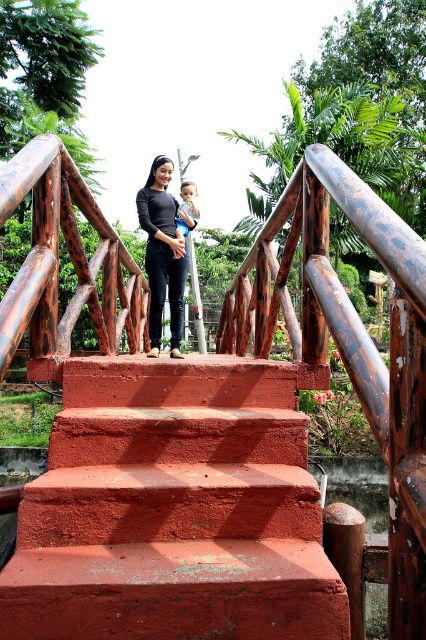
Can you confirm if smooth red concrete stairs at center is thinner than black matte shirt at center?

Incorrect, smooth red concrete stairs at center's width is not less than black matte shirt at center's.

Can you confirm if smooth red concrete stairs at center is taller than black matte shirt at center?

No, smooth red concrete stairs at center is not taller than black matte shirt at center.

Does point (293, 520) lie in front of point (152, 262)?

That is True.

Where is `smooth red concrete stairs at center`? This screenshot has height=640, width=426. smooth red concrete stairs at center is located at coordinates (173, 509).

Is black matte shirt at center positioned at the back of smooth skin baby at center?

No, black matte shirt at center is closer to the viewer.

Is black matte shirt at center above smooth skin baby at center?

Actually, black matte shirt at center is below smooth skin baby at center.

Who is more distant from viewer, (164, 205) or (181, 208)?

Point (181, 208)

I want to click on black matte shirt at center, so click(x=163, y=253).

Can you confirm if smooth red concrete stairs at center is positioned above smooth skin baby at center?

Actually, smooth red concrete stairs at center is below smooth skin baby at center.

Is point (149, 371) in front of point (187, 230)?

That is True.

Find the location of a particular element. This screenshot has height=640, width=426. smooth red concrete stairs at center is located at coordinates (173, 509).